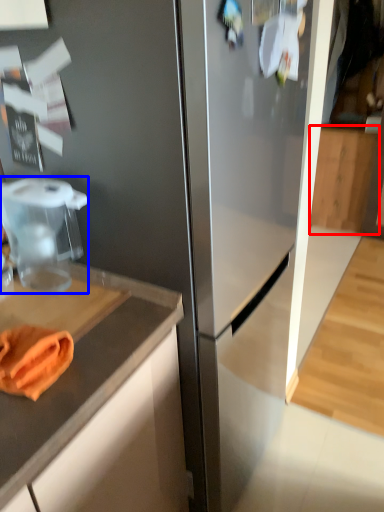
Question: Which object is closer to the camera taking this photo, cabinetry (highlighted by a red box) or food processor (highlighted by a blue box)?

Choices:
 (A) cabinetry
 (B) food processor

Answer: (B)